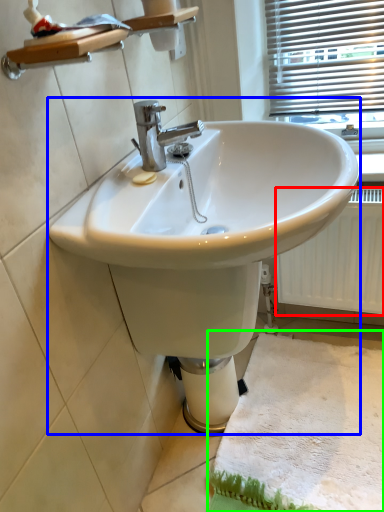
Question: Which object is positioned farthest from radiator (highlighted by a red box)? Select from sink (highlighted by a blue box) and bath mat (highlighted by a green box).

Choices:
 (A) sink
 (B) bath mat

Answer: (A)